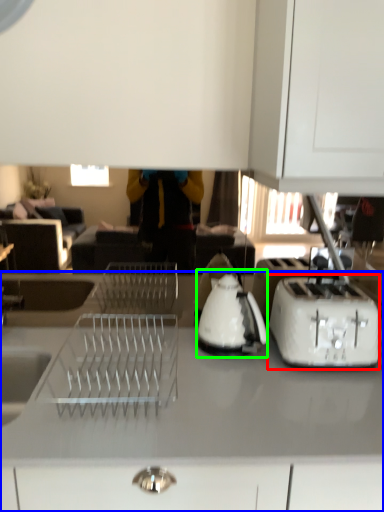
Question: Based on their relative distances, which object is nearer to toaster (highlighted by a red box)? Choose from countertop (highlighted by a blue box) and kettle (highlighted by a green box).

Choices:
 (A) countertop
 (B) kettle

Answer: (B)